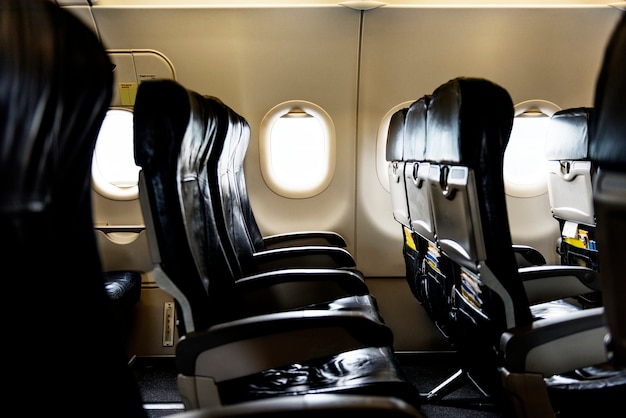
Where is `armrests`? The height and width of the screenshot is (418, 626). armrests is located at coordinates (357, 394), (340, 339), (314, 282), (329, 254), (320, 229), (530, 249), (562, 269), (586, 336).